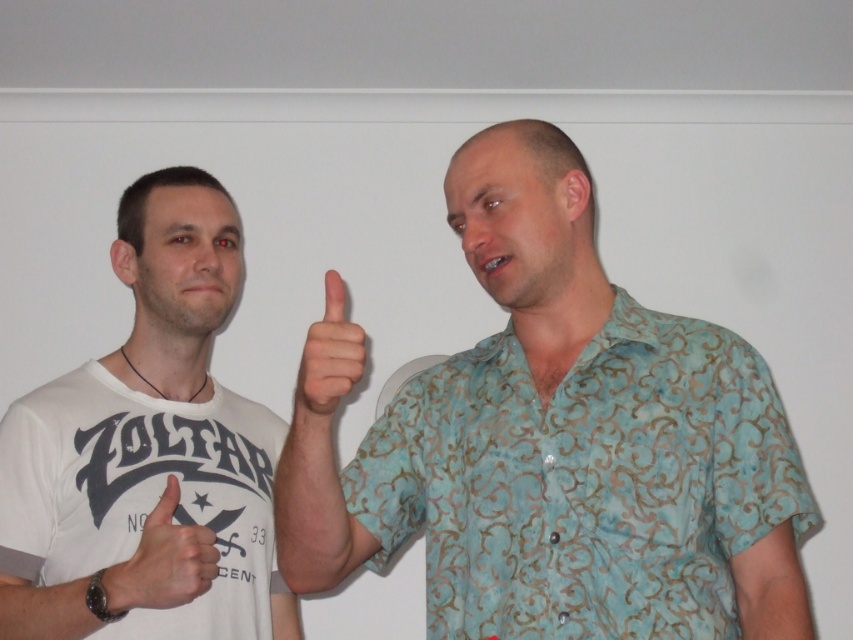
Question: Can you confirm if blue patterned shirt at center is thinner than white cotton t-shirt at left?

Choices:
 (A) yes
 (B) no

Answer: (B)

Question: Among these points, which one is farthest from the camera?

Choices:
 (A) (450, 195)
 (B) (323, 326)
 (C) (223, 468)

Answer: (C)

Question: Which object is positioned closest to the white matte hand at center?

Choices:
 (A) blue patterned shirt at center
 (B) white cotton t-shirt at left
 (C) matte skin at center

Answer: (B)

Question: Does white cotton t-shirt at left lie in front of matte skin at center?

Choices:
 (A) yes
 (B) no

Answer: (B)

Question: Is blue patterned shirt at center below white cotton t-shirt at left?

Choices:
 (A) yes
 (B) no

Answer: (B)

Question: Which of these objects is positioned closest to the matte skin at center?

Choices:
 (A) blue patterned shirt at center
 (B) white cotton t-shirt at left

Answer: (A)